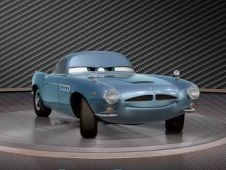
Image resolution: width=226 pixels, height=170 pixels. What are the coordinates of `lights` in the screenshot? It's located at (111, 97).